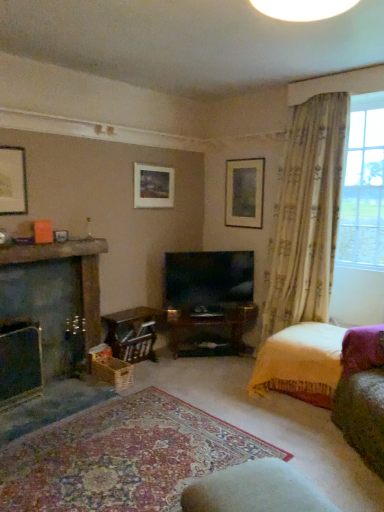
This screenshot has width=384, height=512. What do you see at coordinates (13, 181) in the screenshot?
I see `matte black picture frame at upper left, the 3th picture frame in the right-to-left sequence` at bounding box center [13, 181].

Locate an element on the screen. This screenshot has height=512, width=384. white fabric rocking chair at lower center is located at coordinates (255, 490).

This screenshot has height=512, width=384. Describe the element at coordinates (363, 186) in the screenshot. I see `translucent floral curtains at right` at that location.

Image resolution: width=384 pixels, height=512 pixels. Describe the element at coordinates (207, 278) in the screenshot. I see `flat-screen tv at center` at that location.

Image resolution: width=384 pixels, height=512 pixels. In order to click on velvet yellow bed at lower right in this screenshot , I will do `click(301, 362)`.

Between point (354, 250) and point (249, 184), which one is positioned in front?

The point (354, 250) is closer to the camera.

Are translucent floral curtains at right and matte wooden picture frame at upper center, placed as the 3th picture frame when sorted from left to right, beside each other?

No, translucent floral curtains at right is not in contact with matte wooden picture frame at upper center, placed as the 3th picture frame when sorted from left to right.

Is translucent floral curtains at right oriented away from matte wooden picture frame at upper center, placed as the 3th picture frame when sorted from left to right?

No, translucent floral curtains at right's orientation is not away from matte wooden picture frame at upper center, placed as the 3th picture frame when sorted from left to right.

From the image's perspective, would you say translucent floral curtains at right is positioned over matte wooden picture frame at upper center, which is counted as the 1th picture frame, starting from the back?

Yes.

Does matte wooden picture frame at upper center, acting as the 3th picture frame starting from the front, have a lesser width compared to dark gray stone fireplace at left, the 2th fireplace viewed from the front?

Yes, matte wooden picture frame at upper center, acting as the 3th picture frame starting from the front, is thinner than dark gray stone fireplace at left, the 2th fireplace viewed from the front.

Which is behind, matte wooden picture frame at upper center, which is counted as the 1th picture frame, starting from the back, or dark gray stone fireplace at left, which appears as the 1th fireplace when viewed from the back?

matte wooden picture frame at upper center, which is counted as the 1th picture frame, starting from the back, is more distant.

Considering the sizes of objects matte wooden picture frame at upper center, which is counted as the 1th picture frame, starting from the back, and dark gray stone fireplace at left, the 2th fireplace viewed from the front, in the image provided, who is bigger, matte wooden picture frame at upper center, which is counted as the 1th picture frame, starting from the back, or dark gray stone fireplace at left, the 2th fireplace viewed from the front,?

Bigger between the two is dark gray stone fireplace at left, the 2th fireplace viewed from the front.

From the image's perspective, starting from the dark gray stone fireplace at left, the 2th fireplace viewed from the front, which picture frame is the 2nd one above? Please provide its 2D coordinates.

[(244, 193)]

From a real-world perspective, does floral fabric curtain at right sit lower than dark gray stone fireplace at left, which appears as the 1th fireplace when viewed from the back?

No, from a real-world perspective, floral fabric curtain at right is not below dark gray stone fireplace at left, which appears as the 1th fireplace when viewed from the back.

Is floral fabric curtain at right aimed at dark gray stone fireplace at left, which appears as the 1th fireplace when viewed from the back?

No, floral fabric curtain at right is not turned towards dark gray stone fireplace at left, which appears as the 1th fireplace when viewed from the back.

Looking at this image, considering the sizes of floral fabric curtain at right and dark gray stone fireplace at left, which appears as the 1th fireplace when viewed from the back, in the image, is floral fabric curtain at right taller or shorter than dark gray stone fireplace at left, which appears as the 1th fireplace when viewed from the back,?

Considering their sizes, floral fabric curtain at right has more height than dark gray stone fireplace at left, which appears as the 1th fireplace when viewed from the back.

From the image's perspective, relative to dark gray stone fireplace at left, the 2th fireplace viewed from the front, is floral fabric curtain at right above or below?

floral fabric curtain at right is above dark gray stone fireplace at left, the 2th fireplace viewed from the front.

Between matte black picture frame at upper left, the first picture frame when ordered from left to right, and matte wooden picture frame at upper center, acting as the 3th picture frame starting from the front, which one has smaller size?

matte black picture frame at upper left, the first picture frame when ordered from left to right.

Is matte black picture frame at upper left, the first picture frame when ordered from left to right, positioned beyond the bounds of matte wooden picture frame at upper center, which is counted as the 1th picture frame, starting from the back?

Absolutely, matte black picture frame at upper left, the first picture frame when ordered from left to right, is external to matte wooden picture frame at upper center, which is counted as the 1th picture frame, starting from the back.

Looking at this image, considering the relative positions of matte black picture frame at upper left, acting as the first picture frame starting from the front, and matte wooden picture frame at upper center, placed as the first picture frame when sorted from right to left, in the image provided, is matte black picture frame at upper left, acting as the first picture frame starting from the front, to the left of matte wooden picture frame at upper center, placed as the first picture frame when sorted from right to left, from the viewer's perspective?

Indeed, matte black picture frame at upper left, acting as the first picture frame starting from the front, is positioned on the left side of matte wooden picture frame at upper center, placed as the first picture frame when sorted from right to left.

From the image's perspective, is matte black picture frame at upper left, the 3th picture frame from the back, above matte wooden picture frame at upper center, placed as the first picture frame when sorted from right to left?

No, from the image's perspective, matte black picture frame at upper left, the 3th picture frame from the back, is not above matte wooden picture frame at upper center, placed as the first picture frame when sorted from right to left.

Locate an element on the screen. the 2nd picture frame located above the matte black fireplace at left, which is the 1th fireplace from front to back (from a real-world perspective) is located at coordinates (153, 186).

Does matte gold picture frame at upper center, the second picture frame when ordered from right to left, turn towards matte black fireplace at left, acting as the 2th fireplace starting from the back?

No.

Based on the photo, can you tell me how much matte gold picture frame at upper center, arranged as the second picture frame when viewed from the left, and matte black fireplace at left, acting as the 2th fireplace starting from the back, differ in facing direction?

0.00334 degrees separate the facing orientations of matte gold picture frame at upper center, arranged as the second picture frame when viewed from the left, and matte black fireplace at left, acting as the 2th fireplace starting from the back.

Would you consider matte gold picture frame at upper center, positioned as the second picture frame in back-to-front order, to be distant from matte black fireplace at left, which is the 1th fireplace from front to back?

Yes, matte gold picture frame at upper center, positioned as the second picture frame in back-to-front order, and matte black fireplace at left, which is the 1th fireplace from front to back, are quite far apart.

Is velvet yellow bed at lower right wider than matte black picture frame at upper left, acting as the first picture frame starting from the front?

Correct, the width of velvet yellow bed at lower right exceeds that of matte black picture frame at upper left, acting as the first picture frame starting from the front.

Is velvet yellow bed at lower right positioned before matte black picture frame at upper left, acting as the first picture frame starting from the front?

Yes, velvet yellow bed at lower right is closer to the camera.

Is matte black picture frame at upper left, the first picture frame when ordered from left to right, surrounded by velvet yellow bed at lower right?

No, matte black picture frame at upper left, the first picture frame when ordered from left to right, is not a part of velvet yellow bed at lower right.

From a real-world perspective, count 3rd picture frames upward from the velvet yellow bed at lower right and point to it. Please provide its 2D coordinates.

[(13, 181)]

Is matte black fireplace at left, which is the 1th fireplace from front to back, to the right of floral fabric curtain at right from the viewer's perspective?

In fact, matte black fireplace at left, which is the 1th fireplace from front to back, is to the left of floral fabric curtain at right.

Would you say matte black fireplace at left, acting as the 2th fireplace starting from the back, contains floral fabric curtain at right?

No, matte black fireplace at left, acting as the 2th fireplace starting from the back, does not contain floral fabric curtain at right.

Considering the relative sizes of matte black fireplace at left, acting as the 2th fireplace starting from the back, and floral fabric curtain at right in the image provided, is matte black fireplace at left, acting as the 2th fireplace starting from the back, wider than floral fabric curtain at right?

Incorrect, the width of matte black fireplace at left, acting as the 2th fireplace starting from the back, does not surpass that of floral fabric curtain at right.

From a real-world perspective, is matte black fireplace at left, which is the 1th fireplace from front to back, positioned above or below floral fabric curtain at right?

matte black fireplace at left, which is the 1th fireplace from front to back, is situated lower than floral fabric curtain at right in the real world.

The image size is (384, 512). I want to click on the 2nd picture frame behind the translucent floral curtains at right, so click(x=244, y=193).

From a real-world perspective, count 1st fireplaces downward from the matte wooden picture frame at upper center, which is counted as the 1th picture frame, starting from the back, and point to it. Please provide its 2D coordinates.

[(81, 272)]

Looking at the image, which one is located further to translucent floral curtains at right, matte black picture frame at upper left, acting as the first picture frame starting from the front, or white fabric rocking chair at lower center?

Among the two, matte black picture frame at upper left, acting as the first picture frame starting from the front, is located further to translucent floral curtains at right.

Based on their spatial positions, is dark gray stone fireplace at left, which appears as the 1th fireplace when viewed from the back, or matte wooden picture frame at upper center, placed as the first picture frame when sorted from right to left, further from matte black fireplace at left, acting as the 2th fireplace starting from the back?

Based on the image, matte wooden picture frame at upper center, placed as the first picture frame when sorted from right to left, appears to be further to matte black fireplace at left, acting as the 2th fireplace starting from the back.

From the image, which object appears to be nearer to translucent floral curtains at right, matte black picture frame at upper left, the 3th picture frame in the right-to-left sequence, or dark gray stone fireplace at left, the 2th fireplace viewed from the front?

dark gray stone fireplace at left, the 2th fireplace viewed from the front.

When comparing their distances from wooden crate at lower center, does flat-screen tv at center or translucent floral curtains at right seem closer?

Based on the image, flat-screen tv at center appears to be nearer to wooden crate at lower center.

Based on their spatial positions, is wooden crate at lower center or matte black picture frame at upper left, acting as the first picture frame starting from the front, closer to floral fabric curtain at right?

Among the two, wooden crate at lower center is located nearer to floral fabric curtain at right.

Looking at the image, which one is located further to floral fabric curtain at right, dark gray stone fireplace at left, the 2th fireplace viewed from the front, or matte black fireplace at left, which is the 1th fireplace from front to back?

matte black fireplace at left, which is the 1th fireplace from front to back, is positioned further to the anchor floral fabric curtain at right.

Looking at this image, from the image, which object appears to be nearer to translucent floral curtains at right, white fabric rocking chair at lower center or matte black picture frame at upper left, the first picture frame when ordered from left to right?

Among the two, white fabric rocking chair at lower center is located nearer to translucent floral curtains at right.

Considering their positions, is wooden crate at lower center positioned further to white fabric rocking chair at lower center than dark gray stone fireplace at left, which appears as the 1th fireplace when viewed from the back?

wooden crate at lower center.

Identify the location of television between dark gray stone fireplace at left, the 2th fireplace viewed from the front, and matte wooden picture frame at upper center, placed as the first picture frame when sorted from right to left. The image size is (384, 512). (207, 278).

What are the coordinates of `table between matte black fireplace at left, acting as the 2th fireplace starting from the back, and velvet yellow bed at lower right from left to right` in the screenshot? It's located at (132, 333).

Where is `picture frame situated between matte gold picture frame at upper center, the second picture frame when ordered from right to left, and floral fabric curtain at right from left to right`? The width and height of the screenshot is (384, 512). picture frame situated between matte gold picture frame at upper center, the second picture frame when ordered from right to left, and floral fabric curtain at right from left to right is located at coordinates (244, 193).

In order to click on television between matte gold picture frame at upper center, positioned as the second picture frame in back-to-front order, and translucent floral curtains at right, in the horizontal direction in this screenshot , I will do `click(207, 278)`.